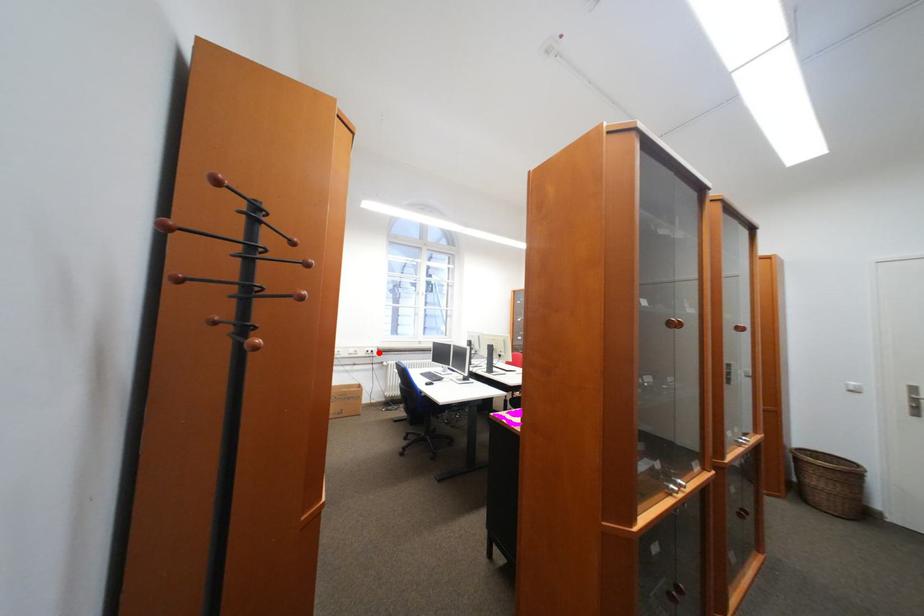
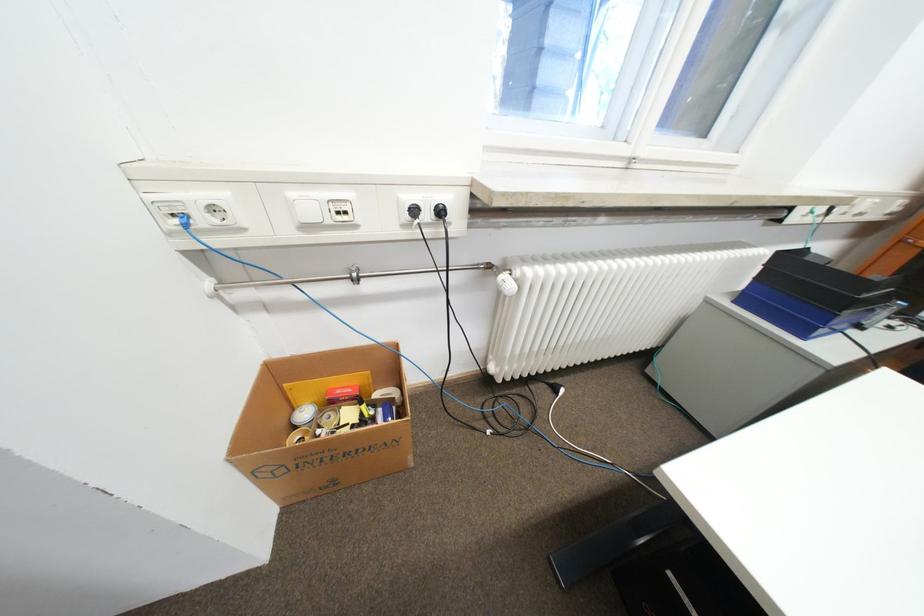
In the second image, find the point that corresponds to the highlighted location in the first image.

(436, 216)